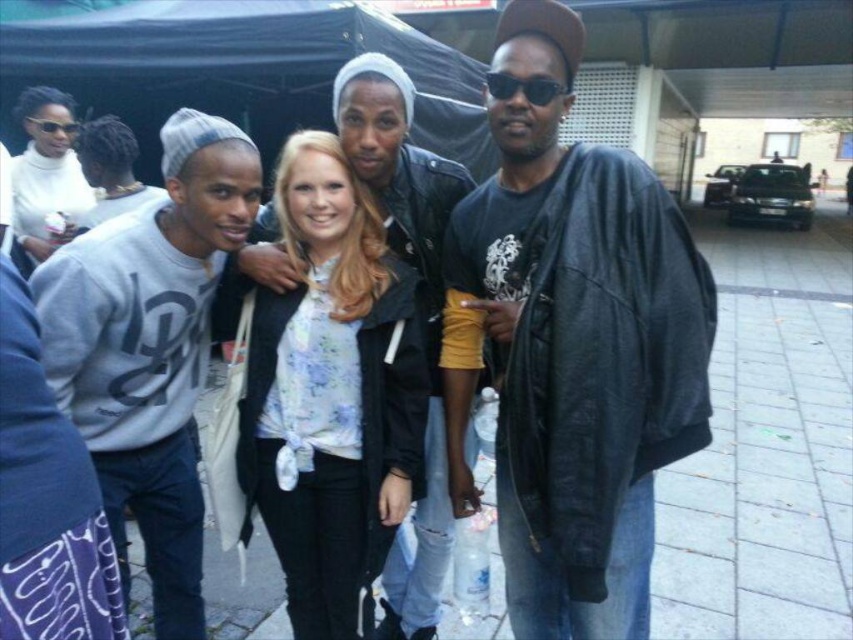
Who is higher up, dark gray leather jacket at center or white matte sweater at upper left?

white matte sweater at upper left

Identify the location of dark gray leather jacket at center. The width and height of the screenshot is (853, 640). (572, 342).

Between dark gray leather jacket at center and gray cotton sweatshirt at left, which one appears on the left side from the viewer's perspective?

Positioned to the left is gray cotton sweatshirt at left.

Who is lower down, dark gray leather jacket at center or gray cotton sweatshirt at left?

gray cotton sweatshirt at left is below.

The image size is (853, 640). Find the location of `dark gray leather jacket at center`. dark gray leather jacket at center is located at coordinates (572, 342).

Does floral print blouse at center have a lesser height compared to white matte sweater at upper left?

In fact, floral print blouse at center may be taller than white matte sweater at upper left.

Is floral print blouse at center to the left of white matte sweater at upper left from the viewer's perspective?

In fact, floral print blouse at center is to the right of white matte sweater at upper left.

Between point (280, 499) and point (24, 211), which one is positioned behind?

Point (24, 211)

Identify the location of floral print blouse at center. (331, 394).